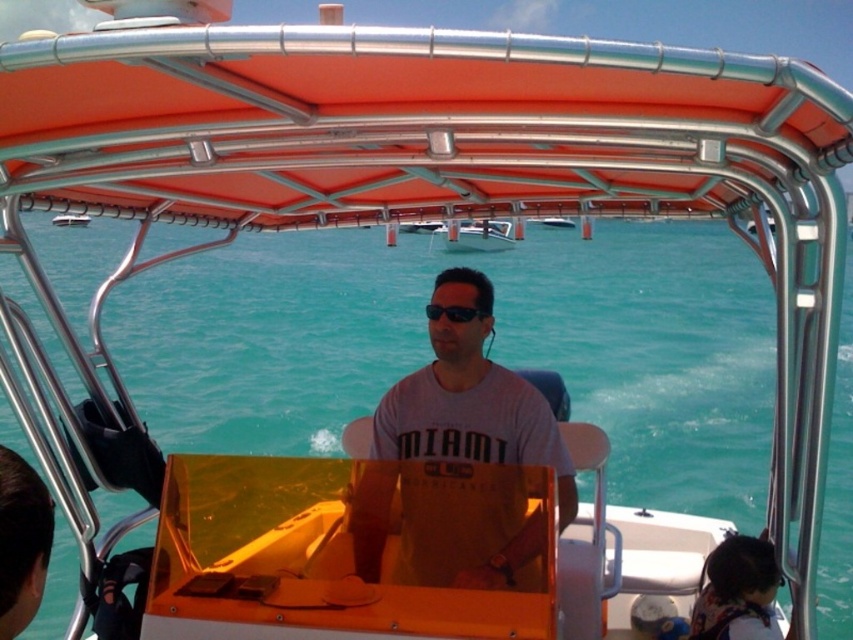
Question: Which object is the farthest from the metallic silver canopy at upper center?

Choices:
 (A) metallic silver boat at center
 (B) black matte sunglasses at center
 (C) matte gray shirt at center
 (D) gray matte shirt at center

Answer: (B)

Question: Is metallic silver boat at center bigger than black matte sunglasses at center?

Choices:
 (A) yes
 (B) no

Answer: (A)

Question: Can you confirm if matte gray shirt at center is positioned above metallic silver boat at center?

Choices:
 (A) yes
 (B) no

Answer: (B)

Question: Which point is farther from the camera taking this photo?

Choices:
 (A) (454, 323)
 (B) (427, 420)

Answer: (B)

Question: Based on their relative distances, which object is nearer to the metallic silver canopy at upper center?

Choices:
 (A) metallic silver boat at center
 (B) matte gray shirt at center

Answer: (B)

Question: Where is gray matte shirt at center located in relation to matte gray shirt at center in the image?

Choices:
 (A) below
 (B) above

Answer: (B)